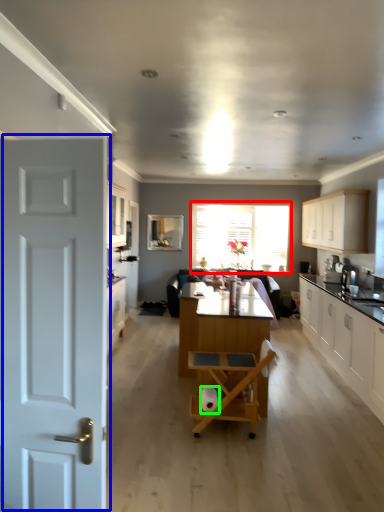
Question: Which object is positioned farthest from window (highlighted by a red box)? Select from door (highlighted by a blue box) and toilet paper (highlighted by a green box).

Choices:
 (A) door
 (B) toilet paper

Answer: (A)